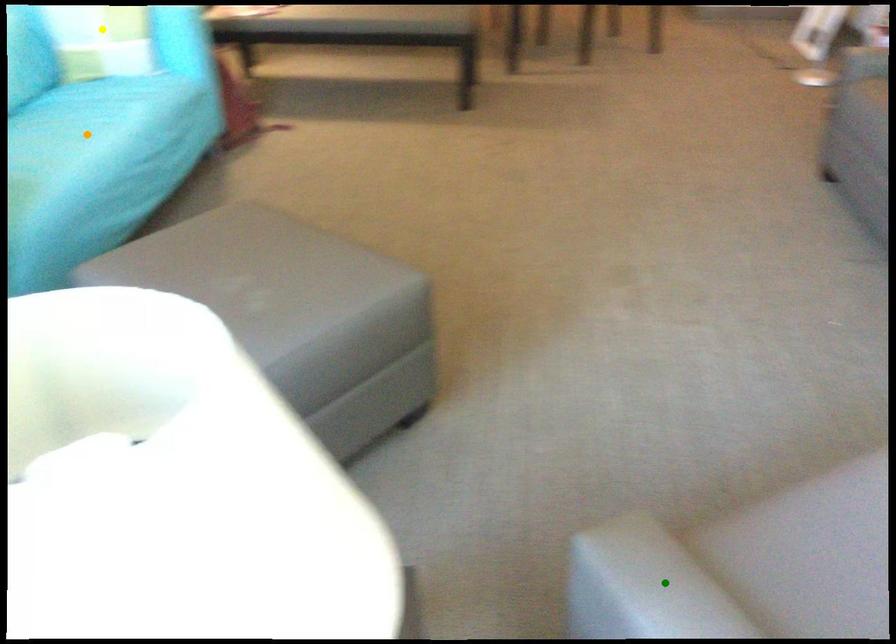
Order these from nearest to farthest:
1. green point
2. yellow point
3. orange point

green point < orange point < yellow point